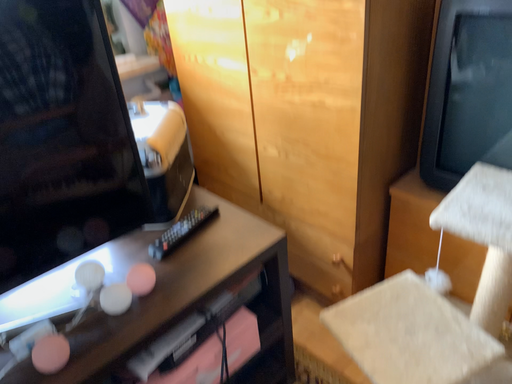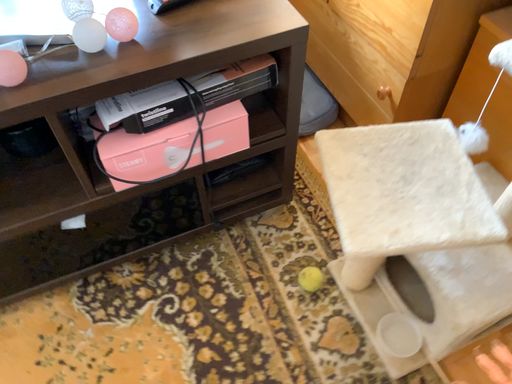
Question: How did the camera likely rotate when shooting the video?

Choices:
 (A) rotated right
 (B) rotated left

Answer: (B)